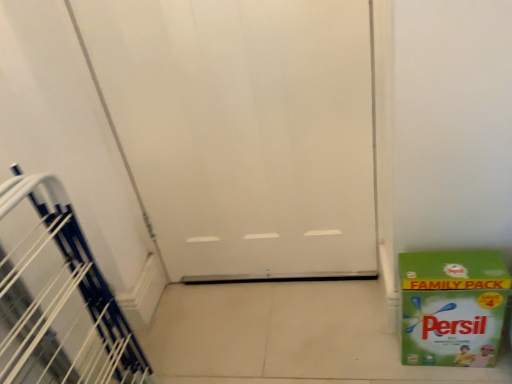
Question: Considering the positions of green paper box at lower right and white matte door at center in the image, is green paper box at lower right wider or thinner than white matte door at center?

Choices:
 (A) thin
 (B) wide

Answer: (B)

Question: Choose the correct answer: Is green paper box at lower right inside white matte door at center or outside it?

Choices:
 (A) inside
 (B) outside

Answer: (B)

Question: Estimate the real-world distances between objects in this image. Which object is closer to the white plastic stairwell at left?

Choices:
 (A) white matte door at center
 (B) green paper box at lower right

Answer: (A)

Question: Which object is positioned farthest from the white plastic stairwell at left?

Choices:
 (A) green paper box at lower right
 (B) white matte door at center

Answer: (A)